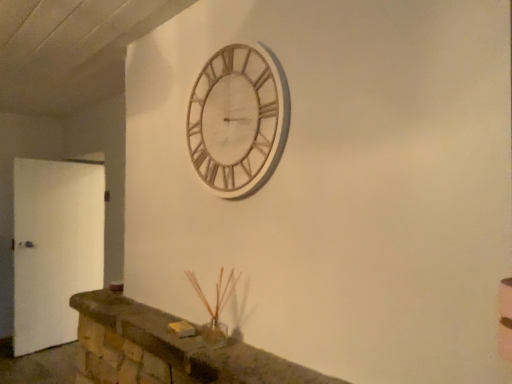
Identify the location of white matte door at left. (55, 247).

Find the location of a particular element. wooden clock at upper center is located at coordinates (238, 119).

What do you see at coordinates (238, 119) in the screenshot? I see `wooden clock at upper center` at bounding box center [238, 119].

This screenshot has height=384, width=512. In order to click on brown stone mantle at lower center in this screenshot , I will do `click(167, 350)`.

From the image's perspective, is white matte door at left below wooden clock at upper center?

Correct, white matte door at left appears lower than wooden clock at upper center in the image.

Is white matte door at left taller than wooden clock at upper center?

Indeed, white matte door at left has a greater height compared to wooden clock at upper center.

Can you confirm if white matte door at left is thinner than wooden clock at upper center?

No, white matte door at left is not thinner than wooden clock at upper center.

Between wooden clock at upper center and brown stone mantle at lower center, which one has larger width?

brown stone mantle at lower center.

This screenshot has width=512, height=384. What are the coordinates of `mantle that appears in front of the wooden clock at upper center` in the screenshot? It's located at (167, 350).

Who is more distant, wooden clock at upper center or brown stone mantle at lower center?

wooden clock at upper center is more distant.

Is wooden clock at upper center to the left of brown stone mantle at lower center from the viewer's perspective?

Incorrect, wooden clock at upper center is not on the left side of brown stone mantle at lower center.

Considering the positions of objects white matte door at left and brown stone mantle at lower center in the image provided, who is more to the right, white matte door at left or brown stone mantle at lower center?

brown stone mantle at lower center.

You are a GUI agent. You are given a task and a screenshot of the screen. Output one action in this format:
    pyautogui.click(x=<x>, y=<y>)
    Task: Click on the door positioned vertically above the brown stone mantle at lower center (from a real-world perspective)
    The image size is (512, 384).
    Given the screenshot: What is the action you would take?
    click(55, 247)

From the image's perspective, is white matte door at left above brown stone mantle at lower center?

No, from the image's perspective, white matte door at left is not over brown stone mantle at lower center.

Is wooden clock at upper center turned away from white matte door at left?

That's not correct — wooden clock at upper center is not looking away from white matte door at left.

From the image's perspective, relative to white matte door at left, is wooden clock at upper center above or below?

Based on their image positions, wooden clock at upper center is located above white matte door at left.

Does point (273, 70) appear closer or farther from the camera than point (42, 194)?

Point (273, 70) is positioned closer to the camera compared to point (42, 194).

Which is correct: brown stone mantle at lower center is inside wooden clock at upper center, or outside of it?

brown stone mantle at lower center lies outside wooden clock at upper center.

Considering the relative positions of brown stone mantle at lower center and wooden clock at upper center in the image provided, is brown stone mantle at lower center to the right of wooden clock at upper center from the viewer's perspective?

In fact, brown stone mantle at lower center is to the left of wooden clock at upper center.

Considering the positions of objects brown stone mantle at lower center and wooden clock at upper center in the image provided, who is in front, brown stone mantle at lower center or wooden clock at upper center?

Positioned in front is brown stone mantle at lower center.

From the image's perspective, between brown stone mantle at lower center and wooden clock at upper center, who is located below?

brown stone mantle at lower center, from the image's perspective.

In the image, is brown stone mantle at lower center positioned in front of or behind white matte door at left?

Visually, brown stone mantle at lower center is located in front of white matte door at left.

Is brown stone mantle at lower center surrounding white matte door at left?

No, white matte door at left is not a part of brown stone mantle at lower center.

You are a GUI agent. You are given a task and a screenshot of the screen. Output one action in this format:
    pyautogui.click(x=<x>, y=<y>)
    Task: Click on the door on the left of brown stone mantle at lower center
    The height and width of the screenshot is (384, 512).
    Given the screenshot: What is the action you would take?
    pyautogui.click(x=55, y=247)

From the image's perspective, which is above, brown stone mantle at lower center or white matte door at left?

brown stone mantle at lower center, from the image's perspective.

Where is `wall clock lying above the white matte door at left (from the image's perspective)`? This screenshot has height=384, width=512. wall clock lying above the white matte door at left (from the image's perspective) is located at coordinates (238, 119).

This screenshot has width=512, height=384. Find the location of `wall clock that appears above the brown stone mantle at lower center (from a real-world perspective)`. wall clock that appears above the brown stone mantle at lower center (from a real-world perspective) is located at coordinates (238, 119).

Which object lies further to the anchor point white matte door at left, brown stone mantle at lower center or wooden clock at upper center?

Based on the image, wooden clock at upper center appears to be further to white matte door at left.

Considering their positions, is wooden clock at upper center positioned further to brown stone mantle at lower center than white matte door at left?

white matte door at left is positioned further to the anchor brown stone mantle at lower center.

Estimate the real-world distances between objects in this image. Which object is closer to wooden clock at upper center, white matte door at left or brown stone mantle at lower center?

brown stone mantle at lower center lies closer to wooden clock at upper center than the other object.

Considering their positions, is wooden clock at upper center positioned closer to white matte door at left than brown stone mantle at lower center?

brown stone mantle at lower center lies closer to white matte door at left than the other object.

Which object lies further to the anchor point wooden clock at upper center, brown stone mantle at lower center or white matte door at left?

Based on the image, white matte door at left appears to be further to wooden clock at upper center.

From the image, which object appears to be nearer to brown stone mantle at lower center, white matte door at left or wooden clock at upper center?

Based on the image, wooden clock at upper center appears to be nearer to brown stone mantle at lower center.

At what (x,y) coordinates should I click in order to perform the action: click on wall clock between brown stone mantle at lower center and white matte door at left from front to back. Please return your answer as a coordinate pair (x, y). Image resolution: width=512 pixels, height=384 pixels. Looking at the image, I should click on (238, 119).